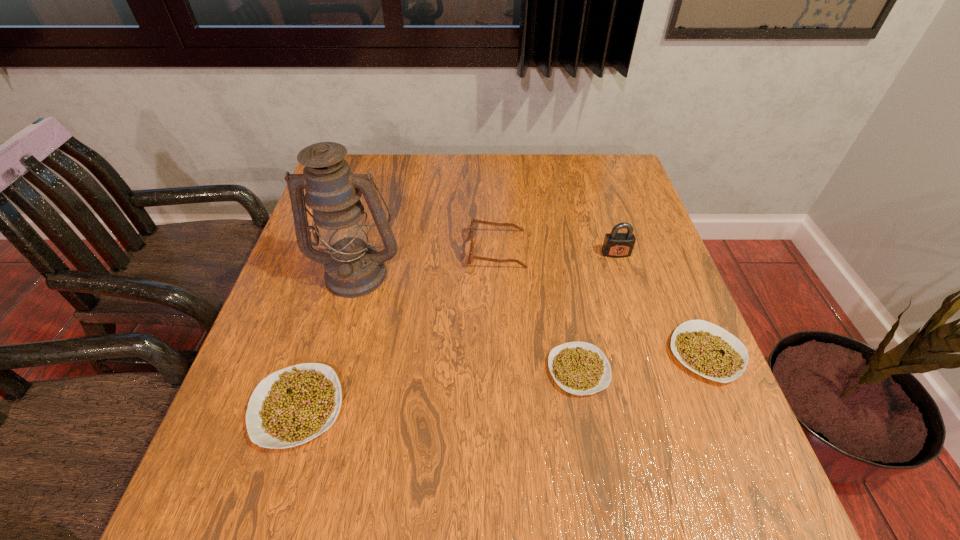
This screenshot has height=540, width=960. What are the coordinates of `vacant space positioned 0.080m on the right of the leftmost legume` in the screenshot? It's located at (387, 407).

Where is `blank space located 0.060m on the back of the third object from right to left`? This screenshot has height=540, width=960. blank space located 0.060m on the back of the third object from right to left is located at coordinates (570, 322).

This screenshot has width=960, height=540. What are the coordinates of `free region located on the back of the second shortest object` in the screenshot? It's located at (680, 290).

At what (x,y) coordinates should I click in order to perform the action: click on free space located 0.360m on the front of the padlock near the keyhole. Please return your answer as a coordinate pair (x, y). The image size is (960, 540). Looking at the image, I should click on (658, 386).

Image resolution: width=960 pixels, height=540 pixels. I want to click on blank area located 0.070m on the front of the oil lamp, so click(x=344, y=322).

Locate an element on the screen. Image resolution: width=960 pixels, height=540 pixels. free spot located on the front-facing side of the spectacles is located at coordinates (336, 249).

The width and height of the screenshot is (960, 540). Find the location of `free point located on the front-facing side of the spectacles`. free point located on the front-facing side of the spectacles is located at coordinates (421, 249).

Image resolution: width=960 pixels, height=540 pixels. I want to click on vacant space situated on the front-facing side of the spectacles, so click(x=328, y=249).

Locate an element on the screen. The width and height of the screenshot is (960, 540). object situated at the near edge is located at coordinates [292, 406].

The height and width of the screenshot is (540, 960). I want to click on legume present at the left edge, so click(292, 406).